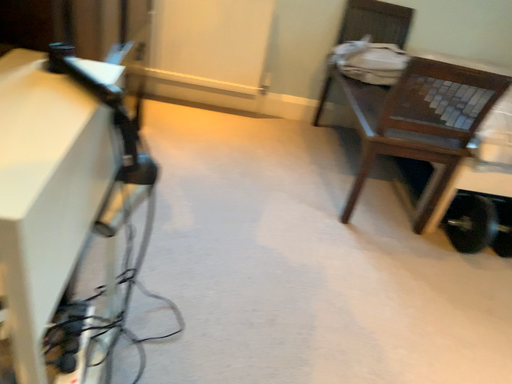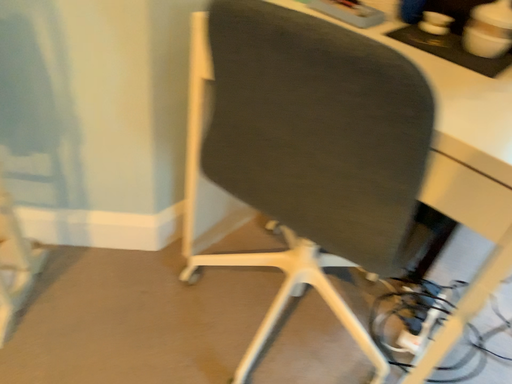
Question: How did the camera likely rotate when shooting the video?

Choices:
 (A) rotated right
 (B) rotated left

Answer: (B)